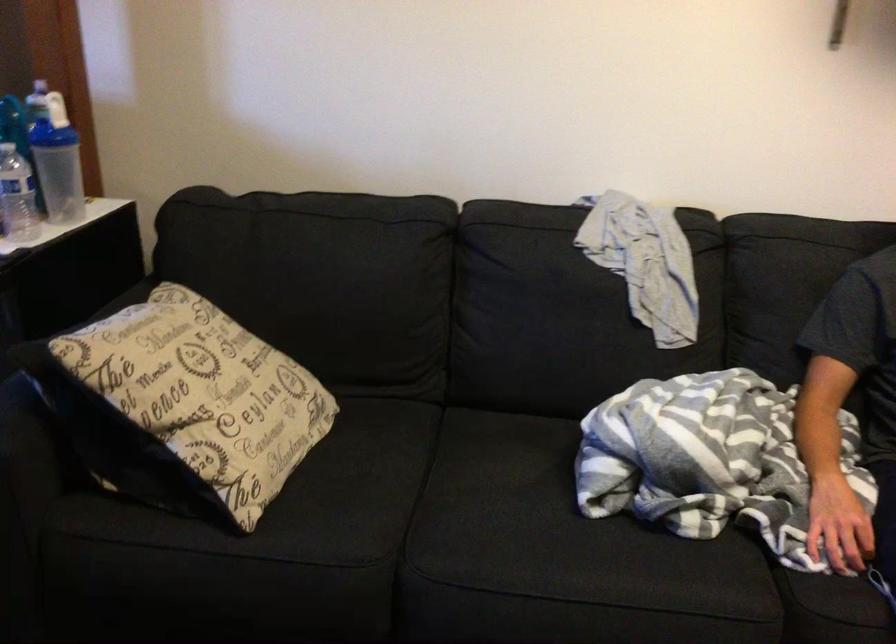
Where would you open the white bottle spout? Please return your answer as a coordinate pair (x, y).

(40, 80)